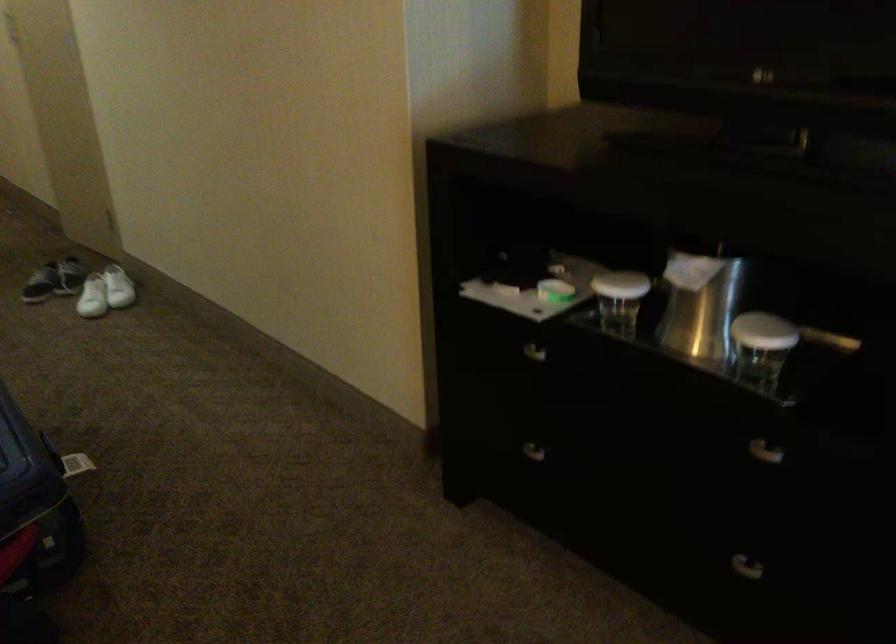
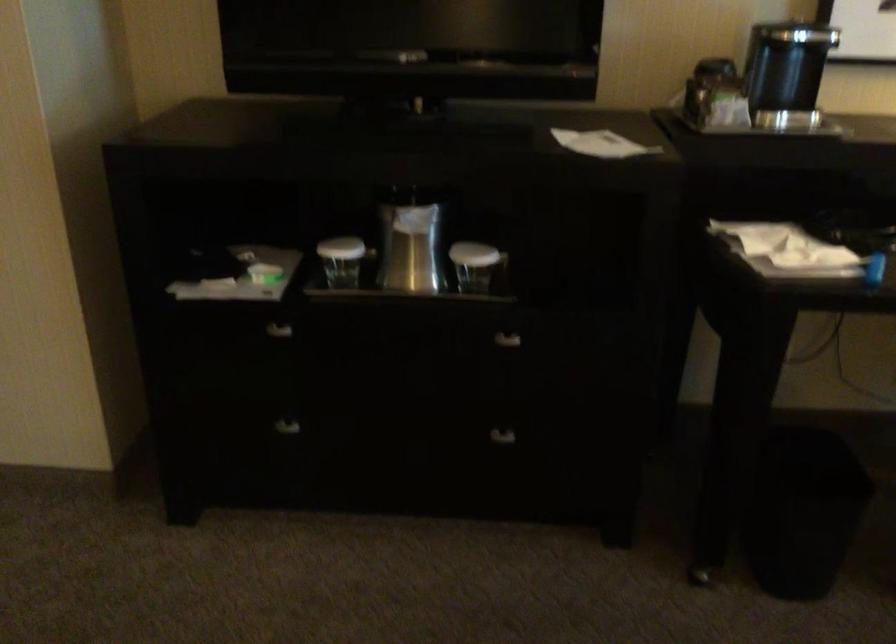
Question: The camera is either moving clockwise (left) or counter-clockwise (right) around the object. The first image is from the beginning of the video and the second image is from the end. Is the camera moving left or right when shooting the video?

Choices:
 (A) Left
 (B) Right

Answer: (A)